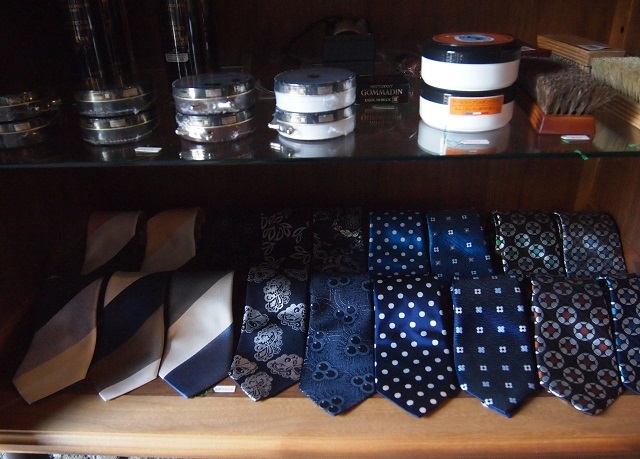
What are the coordinates of `dresser` in the screenshot? It's located at (276, 425).